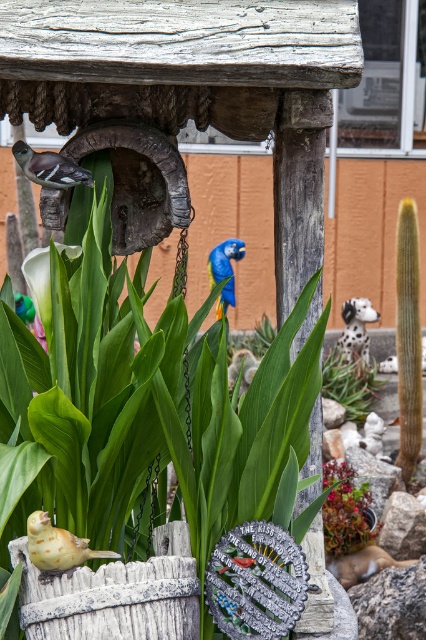
You are a gardener planning to place a new decorative item in the garden. You want to place it exactly at the point marked by the coordinates provided. What object is located at point (345, 509)?

The point (345, 509) marks the location of the matte green succulent at center.

You are standing in the garden and want to place a new decoration between the two points labeled point (333,369) and point (77,252). Based on their positions, which point is closer to you so you can place the decoration appropriately?

Point (77,252) is closer to you since point (333,369) is further away, so place the decoration between them accordingly.

You are a gardener who wants to place a new decorative item in the garden. You have a small statue that is 15 cm tall. The garden has a rule that any new item must be placed at least 20 cm away from the existing items listed in the objects. Can you place the statue at point (49, 168)?

The point (49, 168) is occupied by a matte black bird at center, so you cannot place the statue there as it violates the garden rule requiring 20 cm distance from existing items.